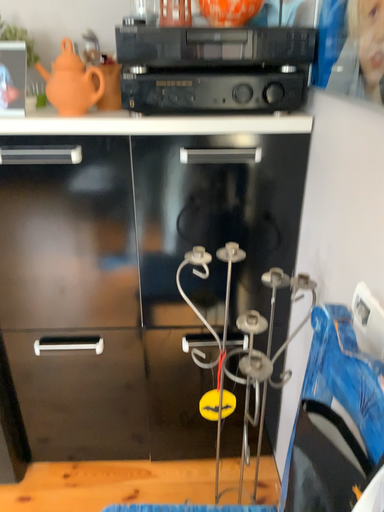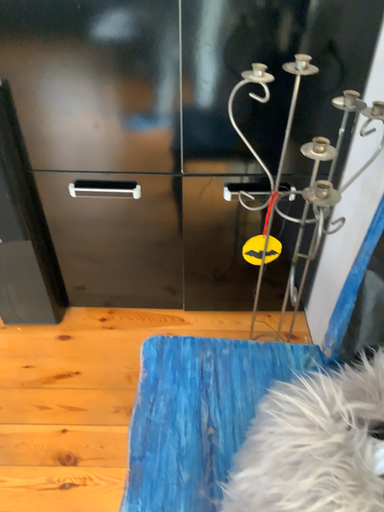
Question: How did the camera likely rotate when shooting the video?

Choices:
 (A) rotated upward
 (B) rotated downward

Answer: (B)